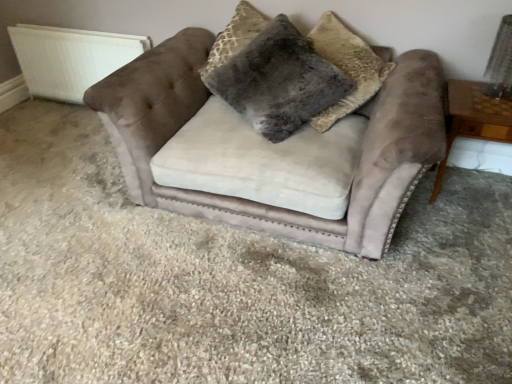
Where is `vacant space in front of velvet couch at center`? Image resolution: width=512 pixels, height=384 pixels. vacant space in front of velvet couch at center is located at coordinates (266, 310).